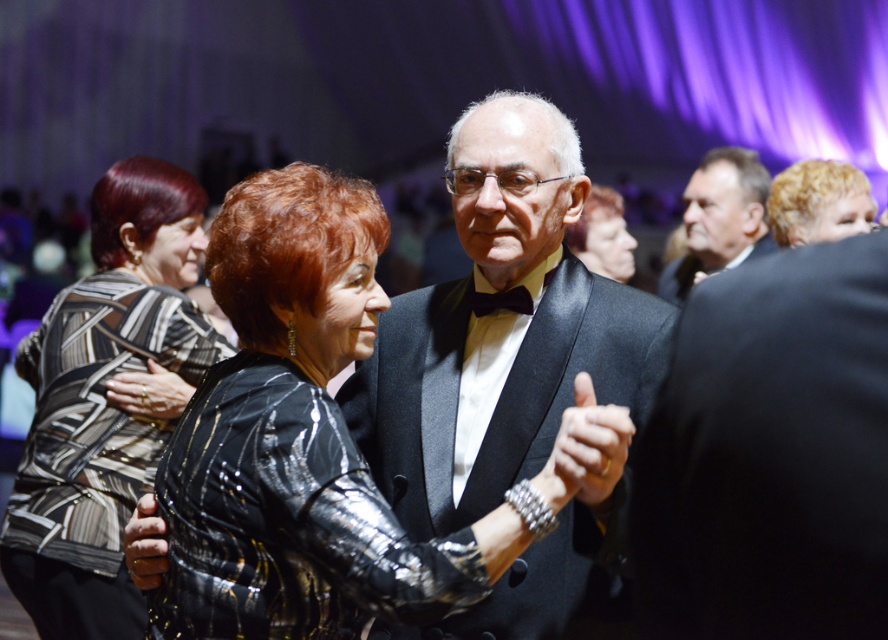
Question: Does satin black suit at center come behind black satin suit at upper right?

Choices:
 (A) yes
 (B) no

Answer: (B)

Question: Is black textured dress at left smaller than black satin bow tie at center?

Choices:
 (A) yes
 (B) no

Answer: (B)

Question: Does shiny black jacket at center come in front of black satin tuxedo at upper center?

Choices:
 (A) yes
 (B) no

Answer: (A)

Question: Estimate the real-world distances between objects in this image. Which object is farther from the black textured dress at left?

Choices:
 (A) satin black suit at center
 (B) black satin tuxedo at upper center

Answer: (B)

Question: Estimate the real-world distances between objects in this image. Which object is closer to the black satin tuxedo at upper center?

Choices:
 (A) black satin suit at upper right
 (B) metallic bracelet at center

Answer: (A)

Question: Based on their relative distances, which object is farther from the black satin suit at upper right?

Choices:
 (A) black satin bow tie at center
 (B) shiny black jacket at center
 (C) black satin tuxedo at upper center

Answer: (B)